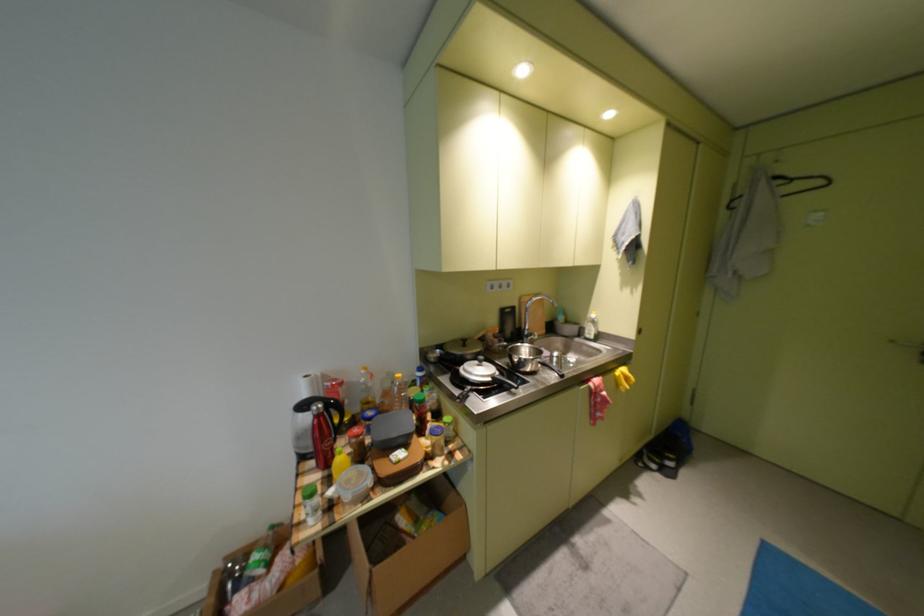
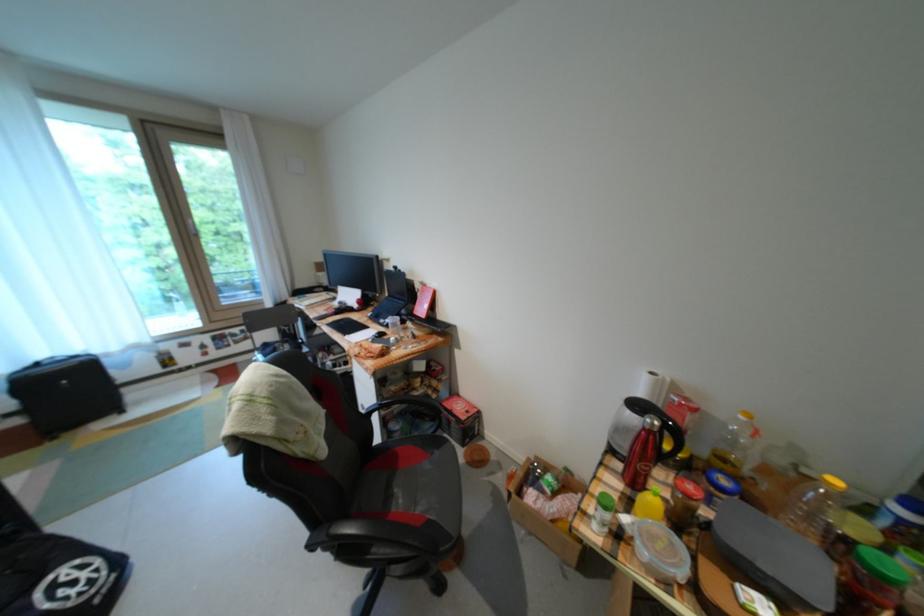
In the second image, find the point that corresponds to [378,424] in the first image.

(723, 490)